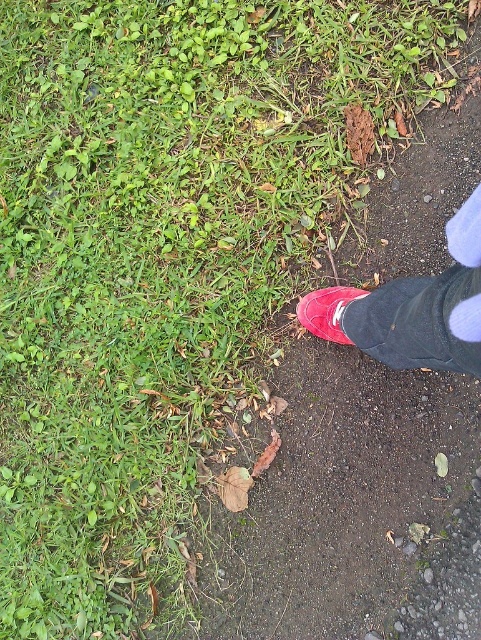
You are standing on the grassy area on the left side of the image and want to step onto the dirt path. The rubber shoe at lower right is in your way. Can you move around it to reach the path safely?

The rubber shoe at lower right is located at point [413,308], so you can move around it to reach the dirt path safely as long as you avoid stepping on the shoe itself.

You are a photographer trying to capture a close up of the grassy area on the left. You have a camera with a 10cm wide lens. The rubber shoe at lower right and the matte red shoe at lower right are blocking your view. Can you determine which shoe you need to move to get a clear shot?

The rubber shoe at lower right is bigger than matte red shoe at lower right, so you should move the rubber shoe at lower right since it is larger and blocking more of the view.